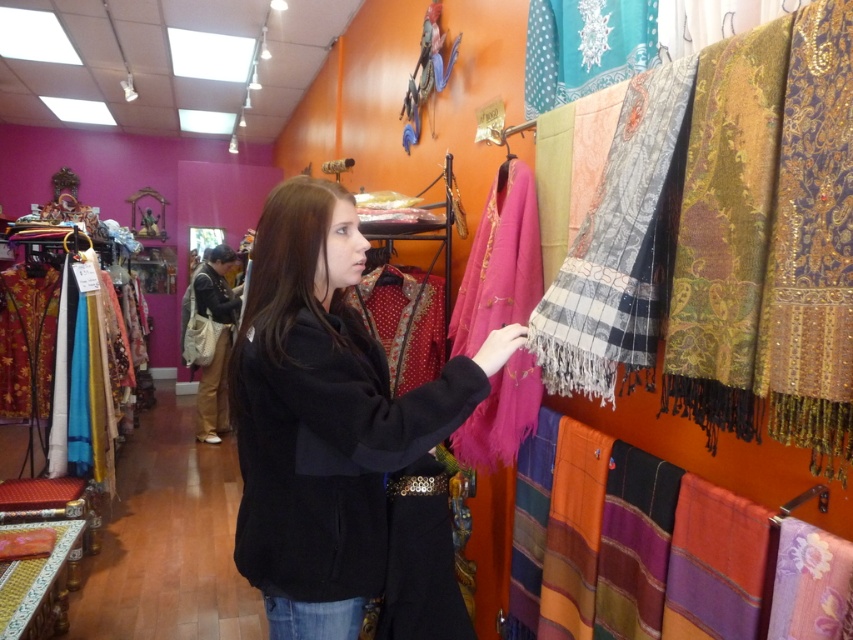
Between point (483, 257) and point (534, 99), which one is positioned in front?

Positioned in front is point (534, 99).

Who is lower down, pink woven scarf at center or teal dotted scarf at upper right?

Positioned lower is pink woven scarf at center.

Who is more distant from viewer, [503,436] or [614,16]?

Point [503,436]

Locate an element on the screen. Image resolution: width=853 pixels, height=640 pixels. pink woven scarf at center is located at coordinates (500, 260).

The width and height of the screenshot is (853, 640). I want to click on striped cotton scarf at lower right, so click(714, 564).

Does striped cotton scarf at lower right appear on the right side of multicolored woven scarf at right?

Correct, you'll find striped cotton scarf at lower right to the right of multicolored woven scarf at right.

Is point (717, 529) closer to viewer compared to point (573, 428)?

Yes.

I want to click on striped cotton scarf at lower right, so click(714, 564).

Is point (578, 349) more distant than point (749, 573)?

Yes, it is behind point (749, 573).

Who is more forward, (582, 275) or (758, 588)?

Positioned in front is point (758, 588).

Does point (625, 220) come farther from viewer compared to point (730, 582)?

Yes, it is behind point (730, 582).

The height and width of the screenshot is (640, 853). I want to click on silky beige scarf at upper right, so click(x=619, y=246).